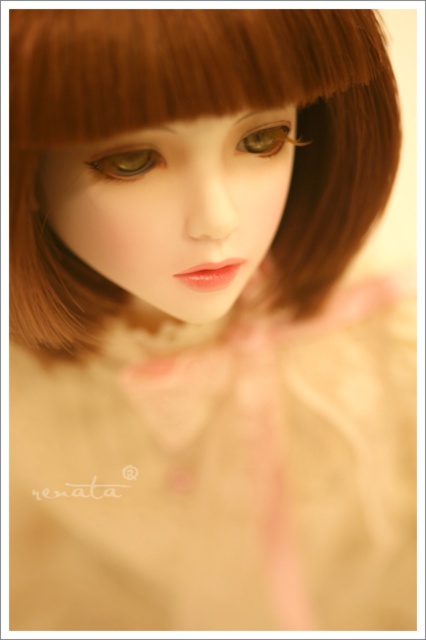
Based on the description, which object has a greater height between the brown matte hair at upper center and the green matte eye at center?

The brown matte hair at upper center has a greater height compared to the green matte eye at center according to the description.

You are an artist sketching the doll and want to ensure the placement of the brown matte hair at upper center and the brown matte eye at center is accurate. According to the image, which object is positioned to the left of the other?

The brown matte hair at upper center is positioned to the left of the brown matte eye at center.